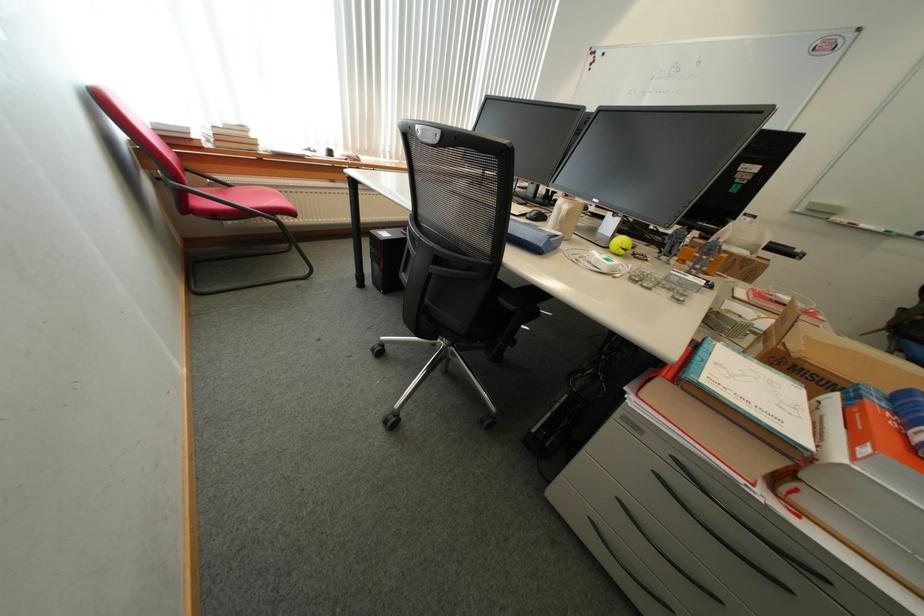
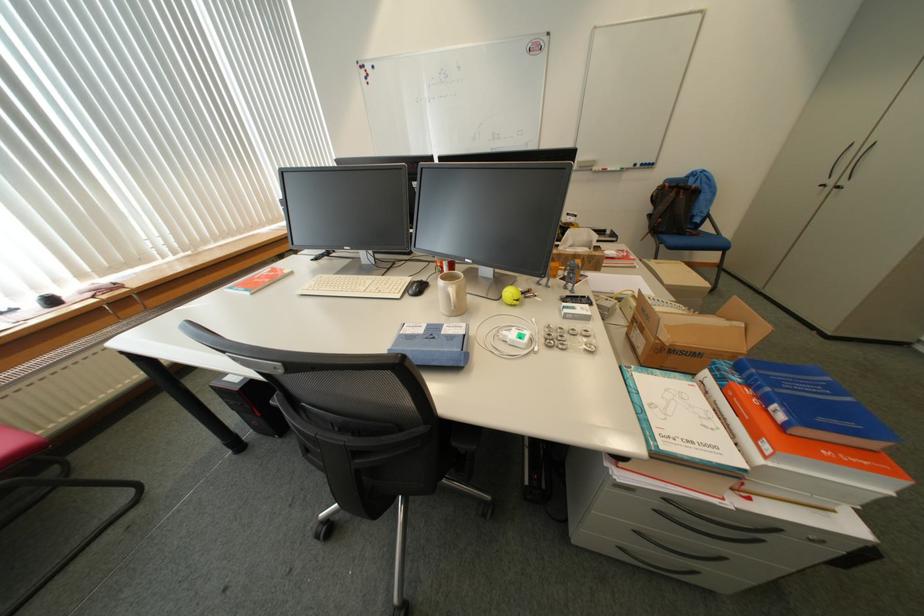
The point at [570,223] is marked in the first image. Where is the corresponding point in the second image?

(465, 309)